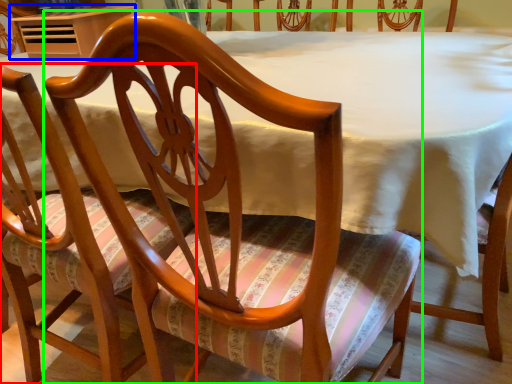
Question: Considering the real-world distances, which object is farthest from chair (highlighted by a red box)? table (highlighted by a blue box) or chair (highlighted by a green box)?

Choices:
 (A) table
 (B) chair

Answer: (A)